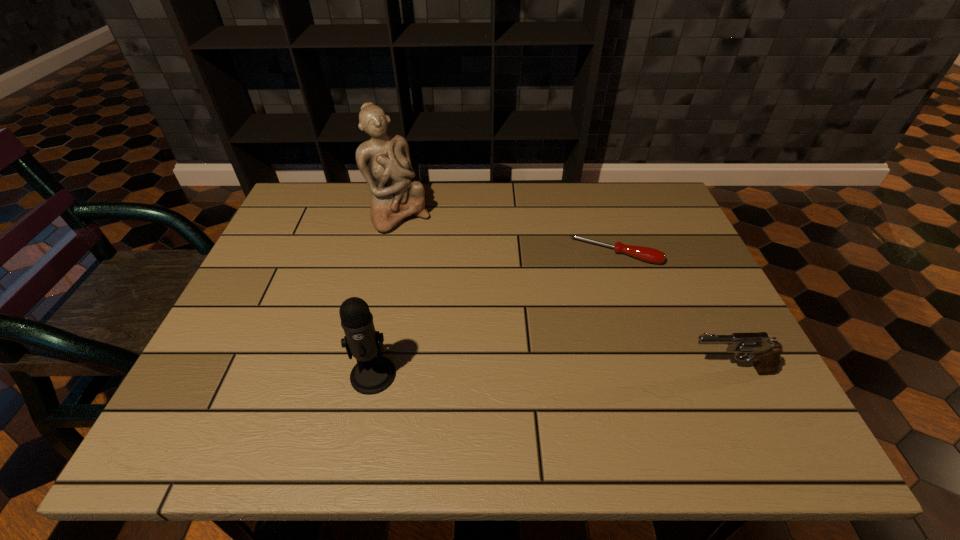
Identify the location of vacant space on the desktop that is between the third shortest object and the second shortest object and is positioned at the tip of the screwdriver. This screenshot has width=960, height=540. coord(578,372).

The image size is (960, 540). I want to click on vacant space on the desktop that is between the second tallest object and the pistol and is positioned on the front-facing side of the farthest object, so click(522, 373).